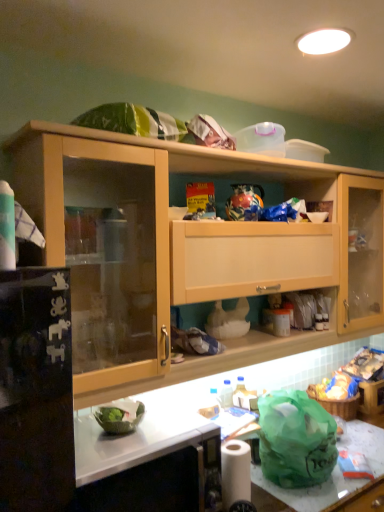
Identify the location of unoccupied region to the right of white matte toilet paper at lower center. (284, 498).